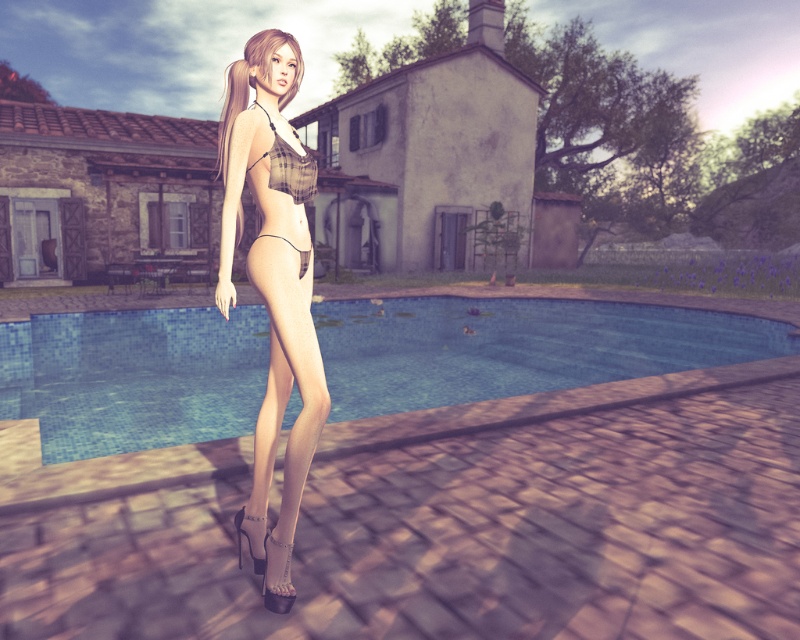
You are a photographer setting up for a shoot. You notice the matte black bikini at center and the clear plastic thong at center in the scene. Which object is positioned higher in the image?

The matte black bikini at center is positioned higher than the clear plastic thong at center in the image.

You are a photographer trying to capture the woman in the plaid fabric bikini top at center. Since the blue tile pool at center is blocking your view, can you move to the left to get a clear shot?

The blue tile pool at center is positioned under the plaid fabric bikini top at center, so moving to the left might still allow you to see the plaid fabric bikini top at center while avoiding the pool.

You are standing at the point with coordinates 0.5, 0.5 in the image. Which direction should you move to reach the blue tile pool at center?

The blue tile pool at center is located at point (516, 348). Since you are at (400, 320), you should move northeast to reach it.